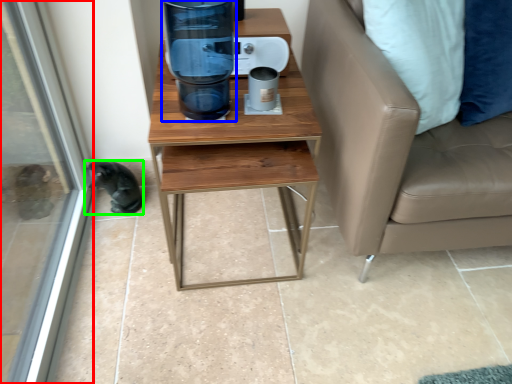
Question: Which is farther away from screen door (highlighted by a red box)? water cooler (highlighted by a blue box) or animal (highlighted by a green box)?

Choices:
 (A) water cooler
 (B) animal

Answer: (A)